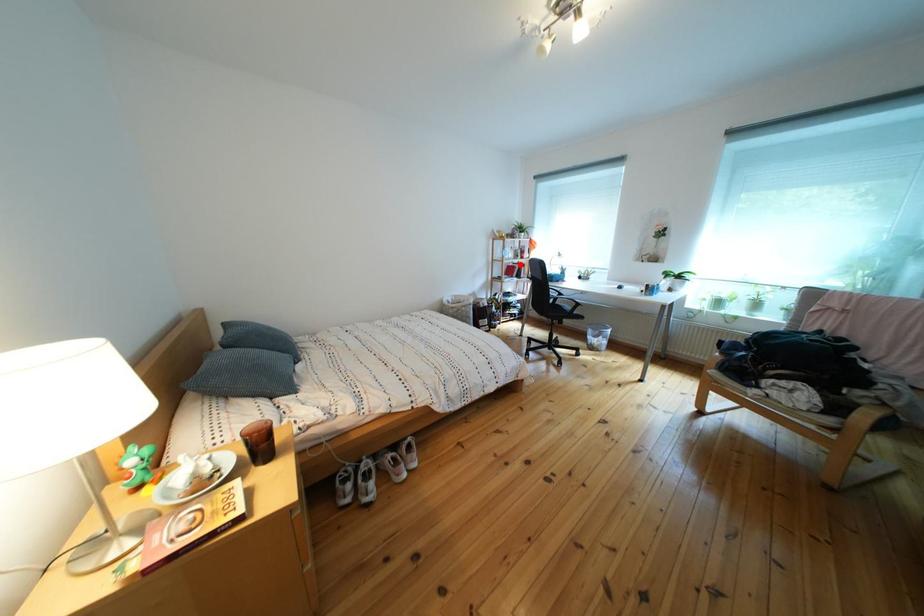
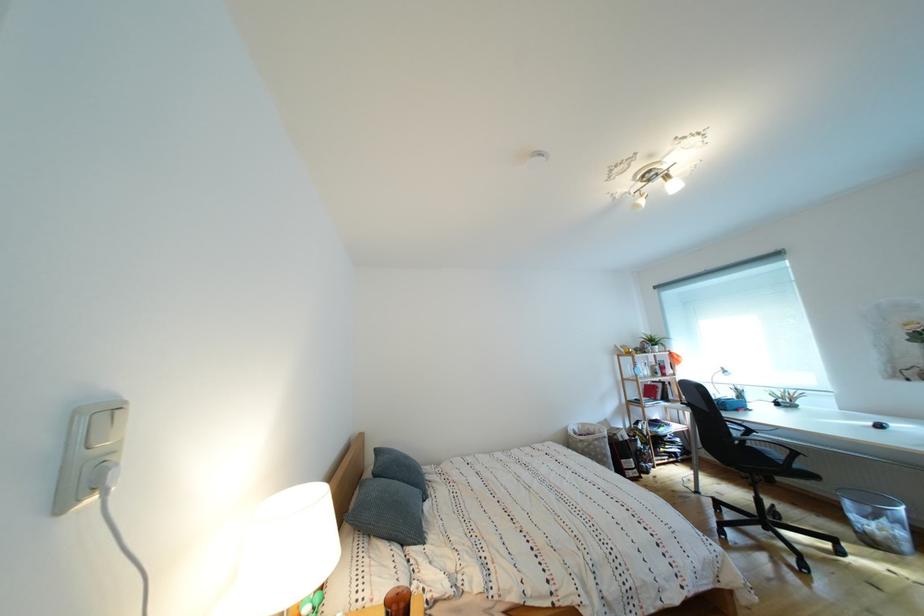
In the second image, find the point that corresponds to the highlighted location in the first image.

(657, 383)